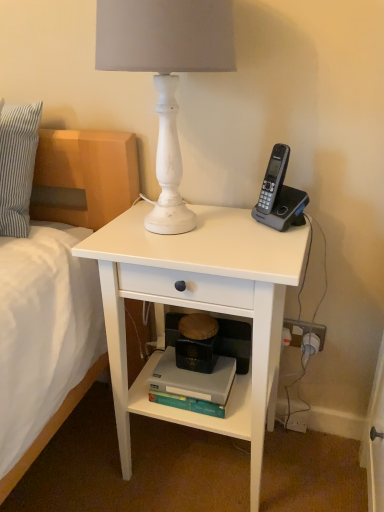
Image resolution: width=384 pixels, height=512 pixels. I want to click on white matte lamp at upper center, so click(166, 73).

Measure the distance between point (296, 344) and camera.

The distance of point (296, 344) from camera is 1.22 meters.

Measure the distance between white matte desk at center and camera.

A distance of 29.82 inches exists between white matte desk at center and camera.

Describe the element at coordinates (17, 166) in the screenshot. I see `white striped pillow at left` at that location.

Identify the location of white matte lamp at upper center. (166, 73).

Considering the relative sizes of white matte desk at center and white striped pillow at left in the image provided, is white matte desk at center thinner than white striped pillow at left?

In fact, white matte desk at center might be wider than white striped pillow at left.

From a real-world perspective, between white matte desk at center and white striped pillow at left, who is vertically higher?

white striped pillow at left.

Which of these two, white matte desk at center or white striped pillow at left, is bigger?

white matte desk at center is bigger.

What's the angular difference between white matte desk at center and white striped pillow at left's facing directions?

The facing directions of white matte desk at center and white striped pillow at left are 0.514 degrees apart.

Can you confirm if white plastic power outlet at lower right is positioned to the left of white matte lamp at upper center?

No.

Can you tell me how much white plastic power outlet at lower right and white matte lamp at upper center differ in facing direction?

The angle between the facing direction of white plastic power outlet at lower right and the facing direction of white matte lamp at upper center is 0.00263 degrees.

Considering the relative sizes of white plastic power outlet at lower right and white matte lamp at upper center in the image provided, is white plastic power outlet at lower right wider than white matte lamp at upper center?

In fact, white plastic power outlet at lower right might be narrower than white matte lamp at upper center.

Which is behind, point (317, 333) or point (174, 185)?

The point (317, 333) is farther.

Image resolution: width=384 pixels, height=512 pixels. I want to click on corded phone below the white striped pillow at left (from the image's perspective), so click(279, 195).

How far apart are gray plastic phone at upper right and white striped pillow at left?

They are 62.06 centimeters apart.

Is gray plastic phone at upper right looking in the opposite direction of white striped pillow at left?

No, gray plastic phone at upper right is not facing away from white striped pillow at left.

How many degrees apart are the facing directions of gray plastic phone at upper right and white striped pillow at left?

The angular difference between gray plastic phone at upper right and white striped pillow at left is 39.3 degrees.

Would you consider white striped pillow at left to be distant from white plastic power outlet at lower right?

white striped pillow at left is near white plastic power outlet at lower right, not far away.

Which of these two, white striped pillow at left or white plastic power outlet at lower right, is bigger?

A: With larger size is white striped pillow at left.

Which object is positioned more to the right, white matte desk at center or white matte lamp at upper center?

white matte desk at center is more to the right.

From a real-world perspective, which object rests below the other?

white matte desk at center, from a real-world perspective.

Is there a large distance between white matte desk at center and white matte lamp at upper center?

Actually, white matte desk at center and white matte lamp at upper center are a little close together.

Considering the positions of points (258, 337) and (161, 197), is point (258, 337) closer to camera compared to point (161, 197)?

That is True.

Between white striped pillow at left and gray plastic phone at upper right, which one has more height?

With more height is white striped pillow at left.

Considering the sizes of objects white striped pillow at left and gray plastic phone at upper right in the image provided, who is bigger, white striped pillow at left or gray plastic phone at upper right?

With larger size is white striped pillow at left.

From a real-world perspective, which is physically below, white striped pillow at left or gray plastic phone at upper right?

gray plastic phone at upper right, from a real-world perspective.

From the image's perspective, would you say white striped pillow at left is shown under gray plastic phone at upper right?

Actually, white striped pillow at left appears above gray plastic phone at upper right in the image.

Who is smaller, hardcover book at lower center or white plastic power outlet at lower right?

With smaller size is white plastic power outlet at lower right.

Is hardcover book at lower center shorter than white plastic power outlet at lower right?

Yes, hardcover book at lower center is shorter than white plastic power outlet at lower right.

Is there a large distance between hardcover book at lower center and white plastic power outlet at lower right?

No, hardcover book at lower center is in close proximity to white plastic power outlet at lower right.

At what (x,y) coordinates should I click in order to perform the action: click on desk that appears below the white striped pillow at left (from a real-world perspective). Please return your answer as a coordinate pair (x, y). The image size is (384, 512). Looking at the image, I should click on (200, 309).

Find the location of a particular element. power outlet that appears on the right of white matte lamp at upper center is located at coordinates (304, 331).

Looking at the image, which one is located further to white plastic power outlet at lower right, white matte lamp at upper center or white matte desk at center?

white matte lamp at upper center lies further to white plastic power outlet at lower right than the other object.

Estimate the real-world distances between objects in this image. Which object is further from hardcover book at lower center, white plastic power outlet at lower right or white matte desk at center?

white plastic power outlet at lower right lies further to hardcover book at lower center than the other object.

Looking at the image, which one is located closer to hardcover book at lower center, white matte desk at center or gray plastic phone at upper right?

white matte desk at center.

Considering their positions, is white striped pillow at left positioned further to white matte desk at center than hardcover book at lower center?

white striped pillow at left.

Estimate the real-world distances between objects in this image. Which object is further from gray plastic phone at upper right, white matte lamp at upper center or hardcover book at lower center?

Among the two, hardcover book at lower center is located further to gray plastic phone at upper right.

Considering their positions, is white matte desk at center positioned closer to gray plastic phone at upper right than white matte lamp at upper center?

Based on the image, white matte lamp at upper center appears to be nearer to gray plastic phone at upper right.

Consider the image. Looking at the image, which one is located further to hardcover book at lower center, white matte desk at center or white plastic power outlet at lower right?

white plastic power outlet at lower right lies further to hardcover book at lower center than the other object.

Based on their spatial positions, is gray plastic phone at upper right or white matte lamp at upper center closer to hardcover book at lower center?

gray plastic phone at upper right lies closer to hardcover book at lower center than the other object.

I want to click on book between white striped pillow at left and white plastic power outlet at lower right in the horizontal direction, so click(x=192, y=385).

Identify the location of desk located between white striped pillow at left and gray plastic phone at upper right in the left-right direction. (200, 309).

This screenshot has height=512, width=384. I want to click on book between white striped pillow at left and gray plastic phone at upper right, so click(192, 385).

Image resolution: width=384 pixels, height=512 pixels. In order to click on lamp between white striped pillow at left and gray plastic phone at upper right in the horizontal direction in this screenshot , I will do `click(166, 73)`.